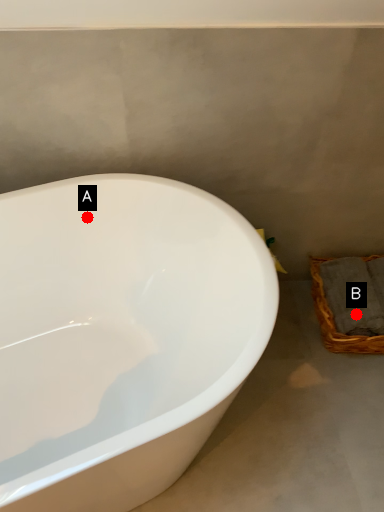
Question: Two points are circled on the image, labeled by A and B beside each circle. Which point appears farthest from the camera in this image?

Choices:
 (A) A is further
 (B) B is further

Answer: (B)